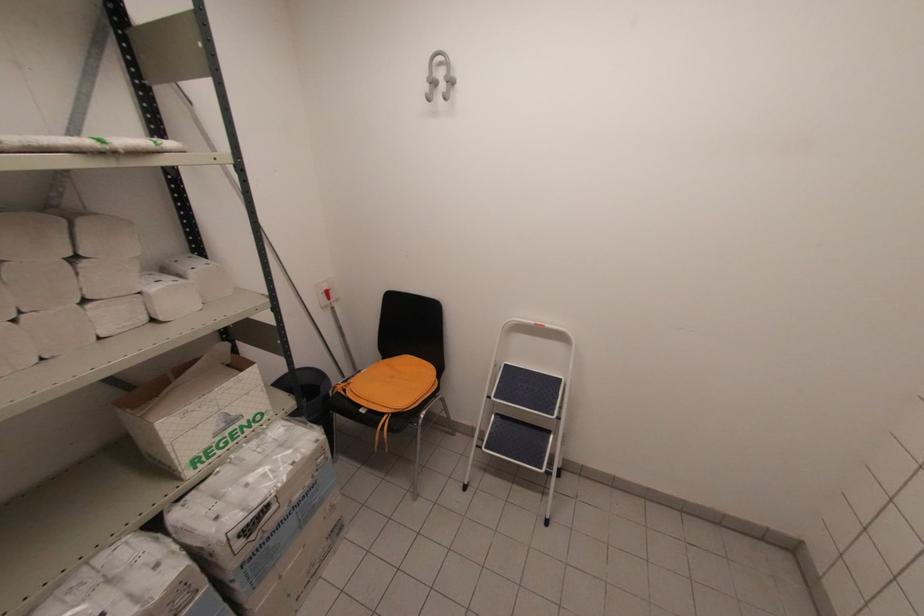
Identify the location of white step stool. coord(525,410).